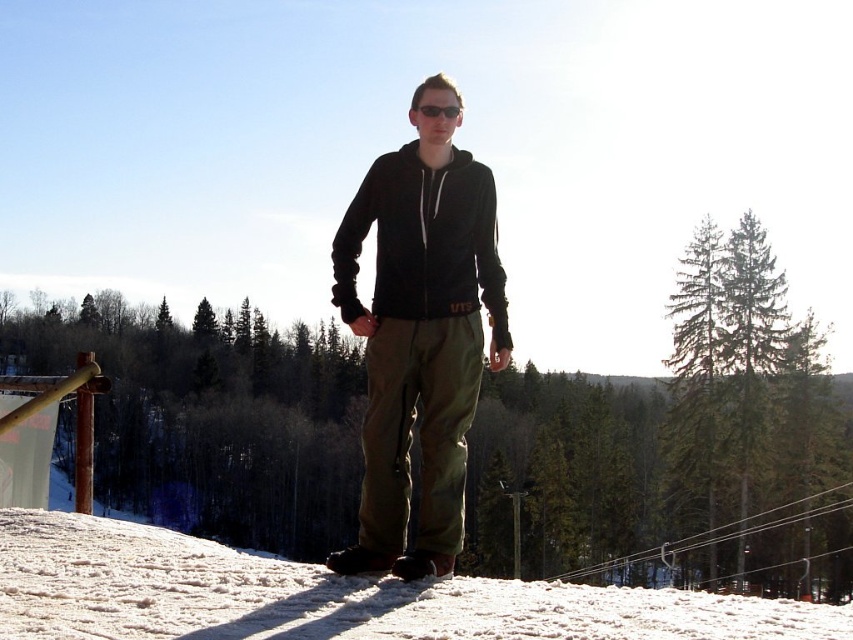
You are a photographer trying to capture the person in the image. If you want to focus on the black fleece sweatshirt at center while avoiding the white snow at lower center in your shot, which direction should you move the camera slightly?

You should move the camera slightly to the right to focus on the black fleece sweatshirt at center while avoiding the white snow at lower center, since the snow is positioned to the left of the sweatshirt.

You are planning to build a snowman using the white snow at lower center and the matte black hoodie at center. Which object would you choose as the base of the snowman and why?

A: The white snow at lower center would be chosen as the base of the snowman because it has a larger size compared to the matte black hoodie at center, making it suitable for the bottom part which requires more volume.